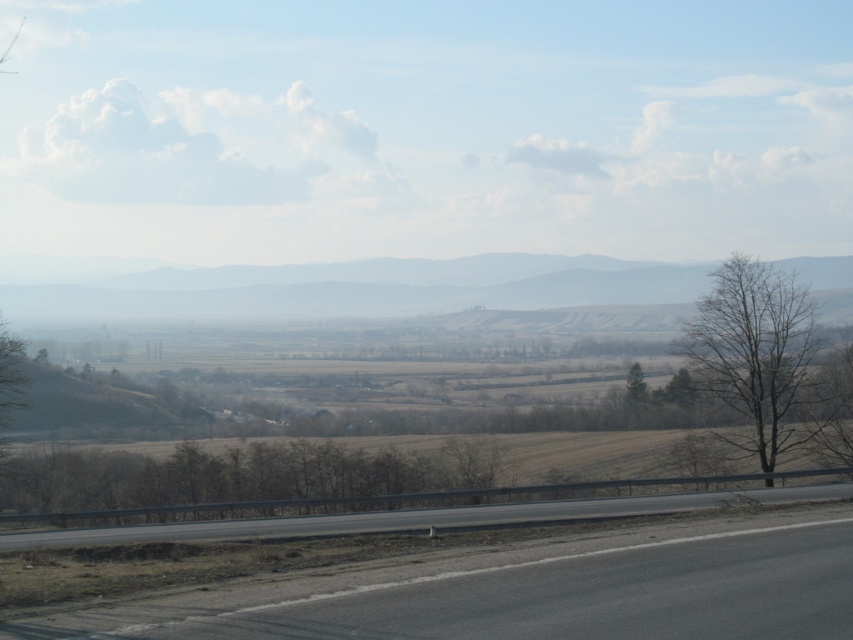
Does foggy haze mountain at center appear on the right side of bare wood tree at right?

Incorrect, foggy haze mountain at center is not on the right side of bare wood tree at right.

Who is positioned more to the left, foggy haze mountain at center or bare wood tree at right?

Positioned to the left is foggy haze mountain at center.

Is point (483, 266) more distant than point (752, 433)?

Yes, it is.

Find the location of a particular element. foggy haze mountain at center is located at coordinates (358, 289).

Does brown matte tree at center have a lesser width compared to bare wood tree at right?

In fact, brown matte tree at center might be wider than bare wood tree at right.

Who is higher up, brown matte tree at center or bare wood tree at right?

Positioned higher is bare wood tree at right.

Which is in front, point (408, 470) or point (724, 435)?

Point (408, 470) is more forward.

This screenshot has height=640, width=853. Find the location of `brown matte tree at center`. brown matte tree at center is located at coordinates (235, 476).

Can you confirm if bare wood tree at right is positioned to the left of smooth asphalt highway at center?

Incorrect, bare wood tree at right is not on the left side of smooth asphalt highway at center.

Does bare wood tree at right have a greater width compared to smooth asphalt highway at center?

Incorrect, bare wood tree at right's width does not surpass smooth asphalt highway at center's.

Is point (763, 340) more distant than point (171, 532)?

Yes, it is.

The height and width of the screenshot is (640, 853). I want to click on bare wood tree at right, so click(753, 353).